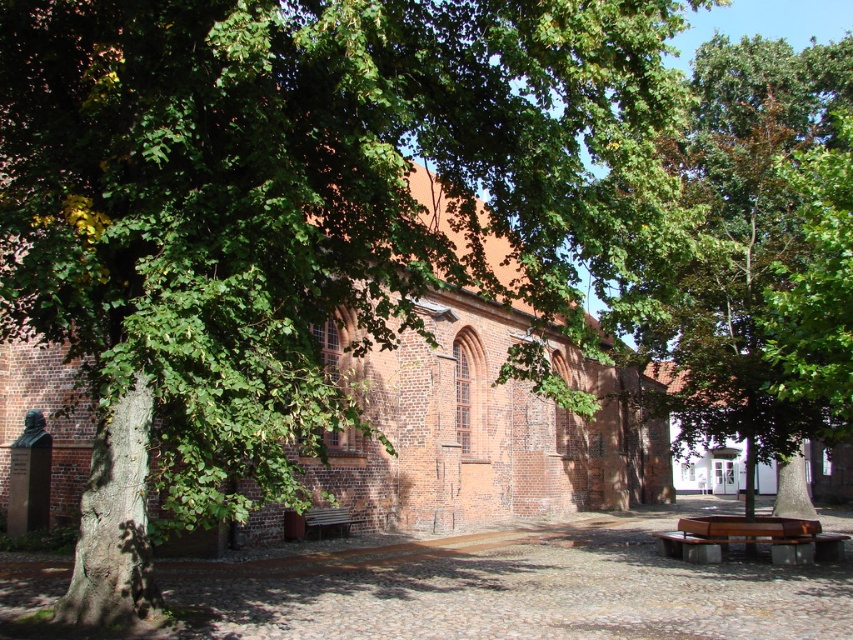
Question: Is green leafy tree at center wider than brown wooden bench at center?

Choices:
 (A) no
 (B) yes

Answer: (B)

Question: Does green leafy tree at center have a lesser width compared to brown wooden bench at lower right?

Choices:
 (A) yes
 (B) no

Answer: (B)

Question: Among these objects, which one is nearest to the camera?

Choices:
 (A) brown wooden bench at lower right
 (B) green leafy tree at center

Answer: (B)

Question: Which object is closer to the camera taking this photo?

Choices:
 (A) brown wooden bench at center
 (B) brown wooden bench at lower right
 (C) green leafy tree at center

Answer: (C)

Question: Based on their relative distances, which object is nearer to the brown wooden bench at center?

Choices:
 (A) brown wooden bench at lower right
 (B) green leafy tree at center

Answer: (A)

Question: Can you confirm if brown wooden bench at lower right is positioned to the left of brown wooden bench at center?

Choices:
 (A) no
 (B) yes

Answer: (A)